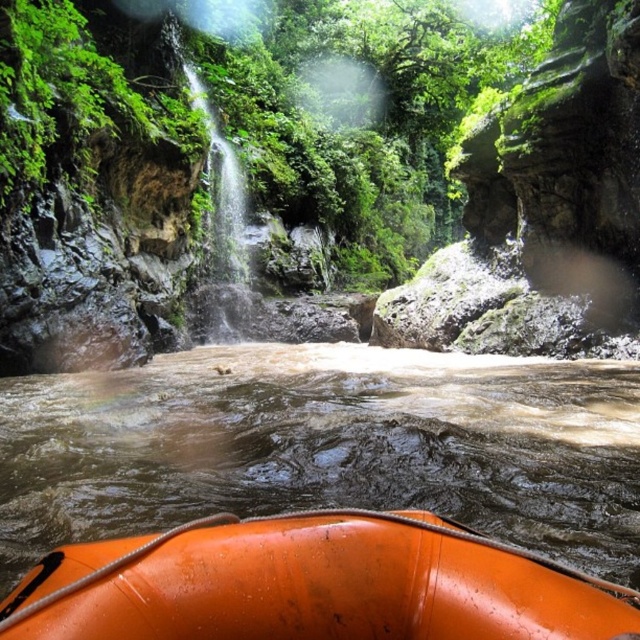
You are on a river rafting trip and need to navigate around a large rock. You see the orange rubber raft at lower center represented by point (310,586). Can you estimate the direction of the current based on the raft position?

The orange rubber raft at lower center represented by point (310,586) is positioned at the lower center of the image, which typically indicates it is moving downstream with the current towards the bottom of the frame.

You are a river guide preparing for a rafting trip. You have two vessels available, the orange rubber raft at lower center and the orange rubber boat at lower center. Which vessel can carry more passengers based on their sizes?

The orange rubber raft at lower center is larger in size than the orange rubber boat at lower center, so it can carry more passengers.

Based on the photo, you are a participant in the river rafting activity and are currently looking at the orange rubber raft at lower center and the orange rubber boat at lower center. Which one is closer to you?

The orange rubber raft at lower center is closer to you because it is further to the viewer than the orange rubber boat at lower center.